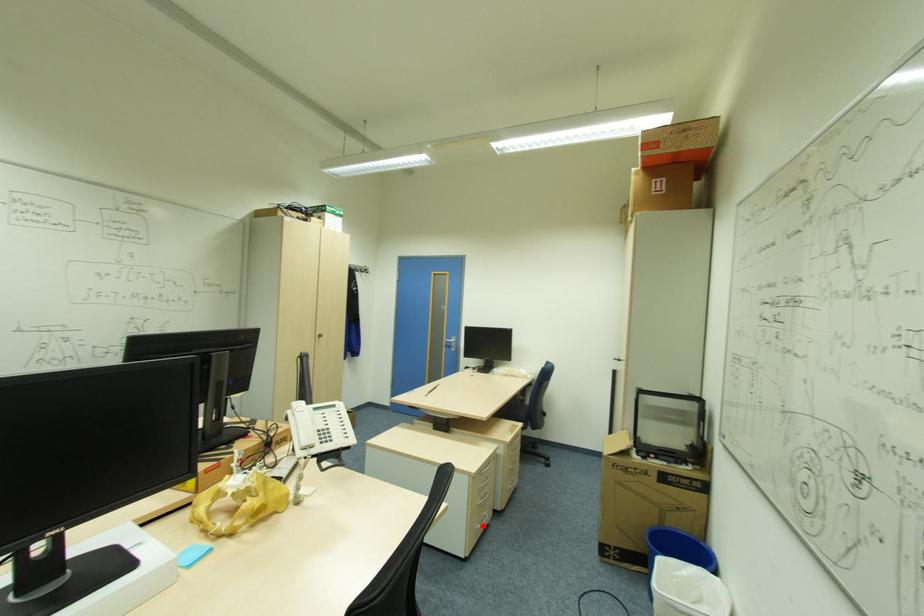
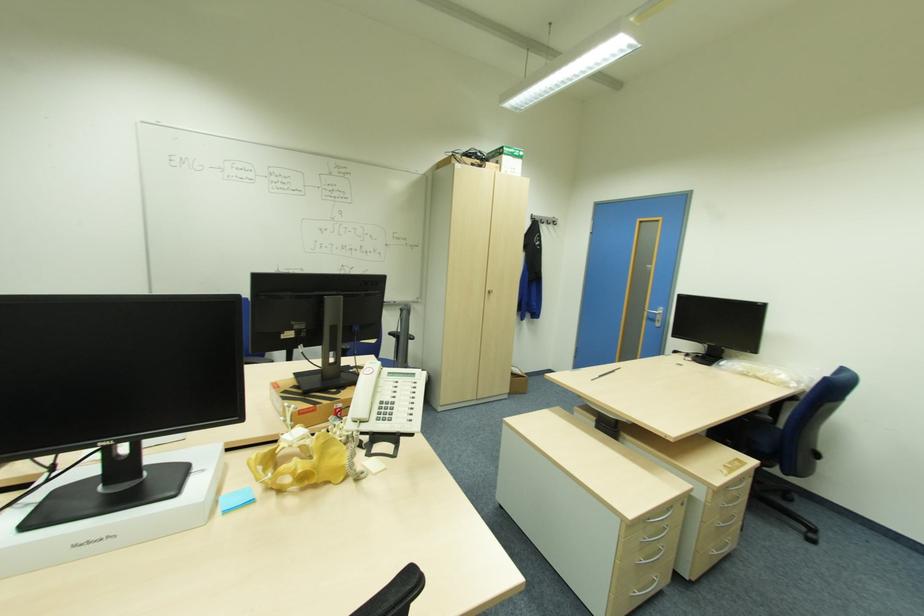
In the second image, find the point that corresponds to the highlighted location in the first image.

(641, 594)